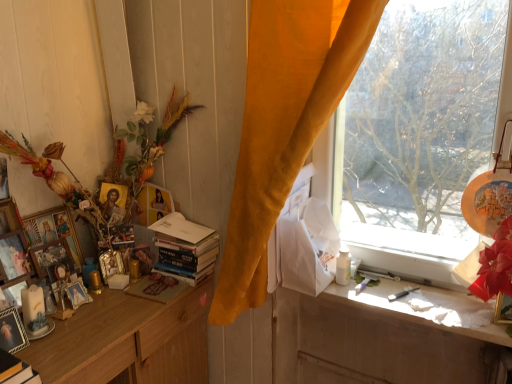
Where is `space that is in front of silver metallic picture frame at left, positioned as the second picture frame in right-to-left order`? Image resolution: width=512 pixels, height=384 pixels. space that is in front of silver metallic picture frame at left, positioned as the second picture frame in right-to-left order is located at coordinates (113, 302).